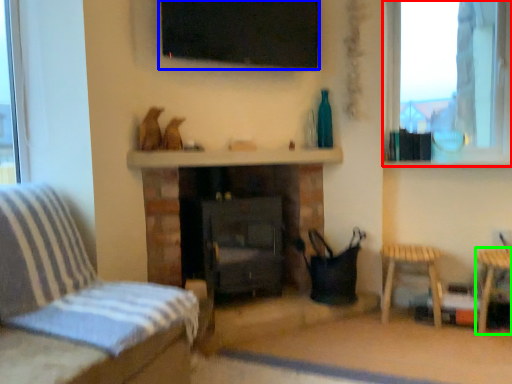
Question: Considering the real-world distances, which object is farthest from window (highlighted by a red box)? window screen (highlighted by a blue box) or side table (highlighted by a green box)?

Choices:
 (A) window screen
 (B) side table

Answer: (B)